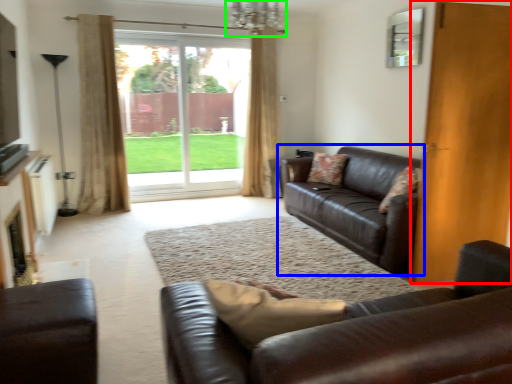
Question: Considering the real-world distances, which object is closest to door (highlighted by a red box)? studio couch (highlighted by a blue box) or chandelier (highlighted by a green box).

Choices:
 (A) studio couch
 (B) chandelier

Answer: (A)